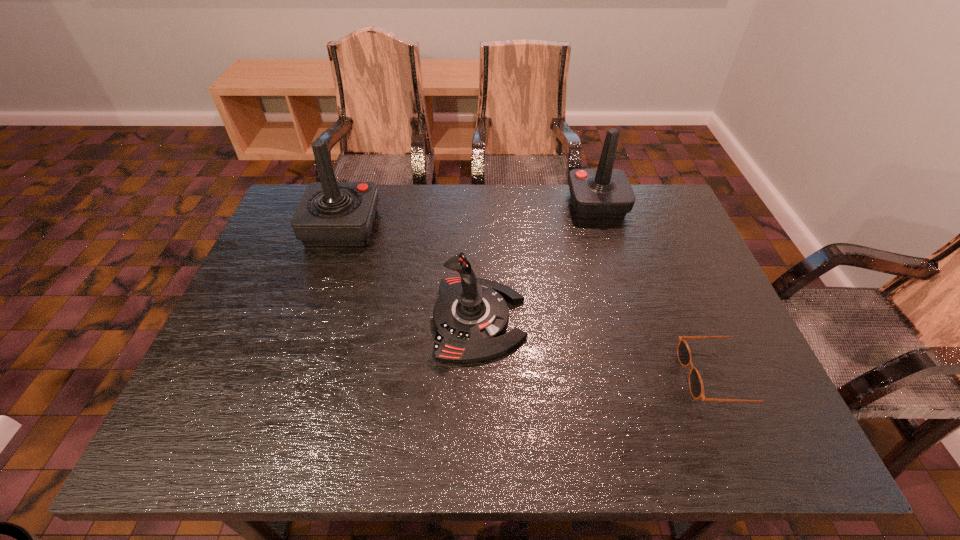
Find the location of a particular element. vacant space that's between the second object from left to right and the leftmost joystick is located at coordinates (410, 273).

At what (x,y) coordinates should I click in order to perform the action: click on empty location between the leftmost joystick and the rightmost joystick. Please return your answer as a coordinate pair (x, y). Looking at the image, I should click on tap(469, 215).

The height and width of the screenshot is (540, 960). Identify the location of object identified as the second closest to the rightmost joystick. (696, 387).

Identify the location of object that stands as the second closest to the shortest joystick. (604, 192).

Find the location of a particular element. Image resolution: width=960 pixels, height=540 pixels. joystick that is the second closest to the leftmost joystick is located at coordinates [x=604, y=192].

Where is `joystick that stands as the second closest to the second joystick from right to left`? The image size is (960, 540). joystick that stands as the second closest to the second joystick from right to left is located at coordinates (604, 192).